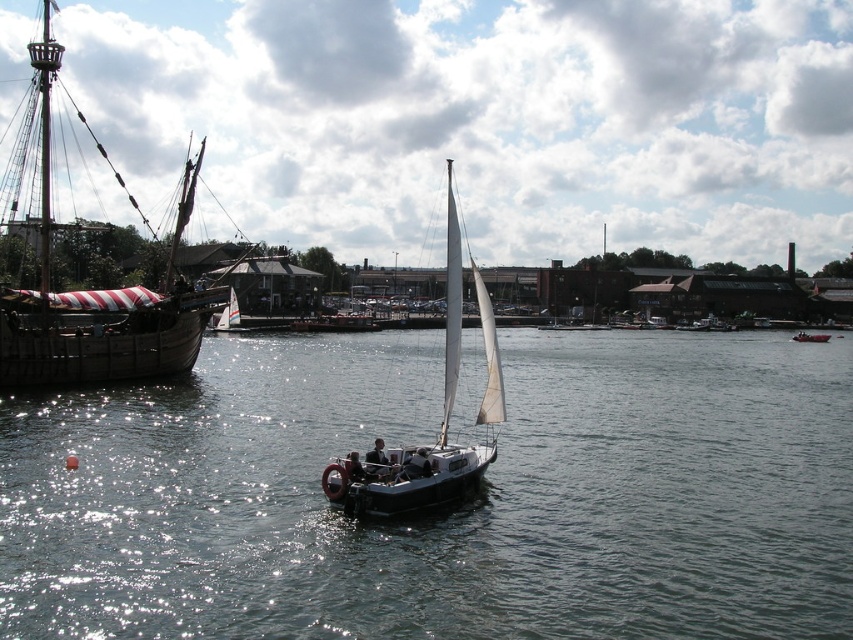
Question: Does wooden ship at left appear over red plastic boat at center?

Choices:
 (A) no
 (B) yes

Answer: (B)

Question: From the image, what is the correct spatial relationship of white sailboat at center in relation to red plastic boat at center?

Choices:
 (A) left
 (B) right

Answer: (A)

Question: Which object is the farthest from the white sailboat at center?

Choices:
 (A) red plastic boat at center
 (B) clear water at center
 (C) wooden ship at left

Answer: (A)

Question: Among these points, which one is nearest to the camera?

Choices:
 (A) (79, 227)
 (B) (366, 484)
 (C) (804, 333)

Answer: (B)

Question: Which point appears farthest from the camera in this image?

Choices:
 (A) (450, 192)
 (B) (53, 221)
 (C) (795, 378)

Answer: (A)

Question: Does clear water at center appear under red plastic boat at center?

Choices:
 (A) no
 (B) yes

Answer: (B)